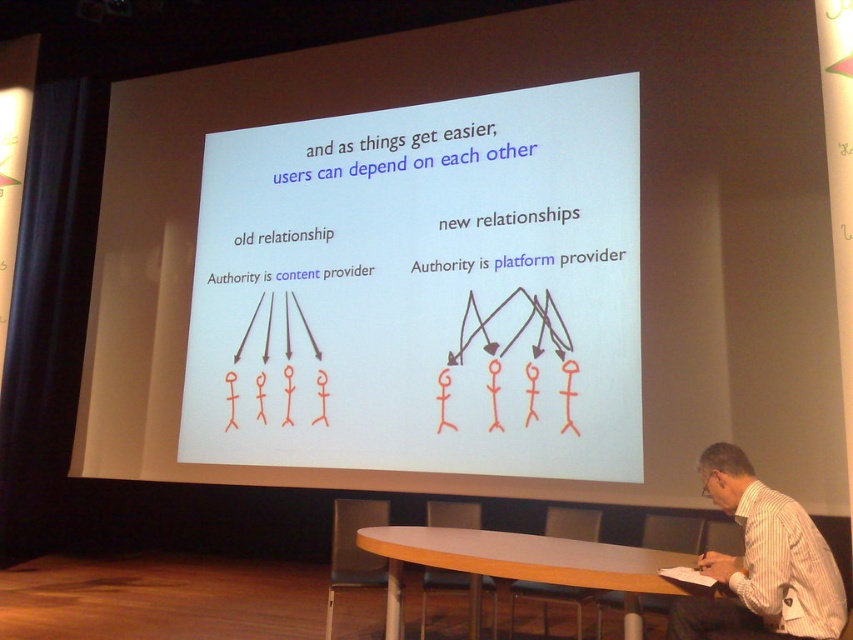
You are an attendee at the presentation and notice two points on the slide. The first point is labeled as point 1 at coordinates [259,433], and the second point is labeled as point 2 at coordinates [532,564]. Which point is closer to you?

Point 1 at coordinates [259,433] is closer to you because it is further to the viewer than point 2 at coordinates [532,564].

You are a photographer standing in the presentation room. You want to take a photo of the white striped shirt at lower right and the light brown wooden table at center. Which object should be placed on the right side of the photo frame?

The white striped shirt at lower right should be placed on the right side of the photo frame because it is positioned on the right side of the light brown wooden table at center in the scene.